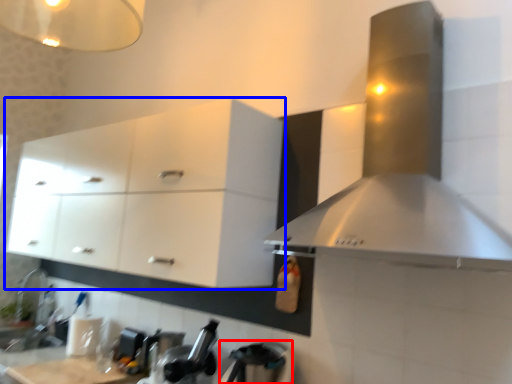
Question: Which object is closer to the camera taking this photo, appliance (highlighted by a red box) or cabinetry (highlighted by a blue box)?

Choices:
 (A) appliance
 (B) cabinetry

Answer: (A)